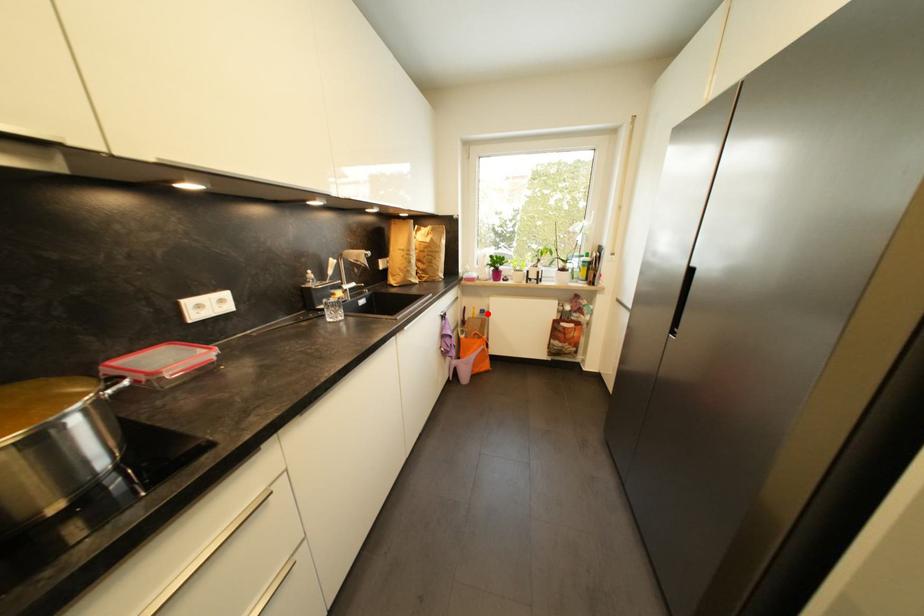
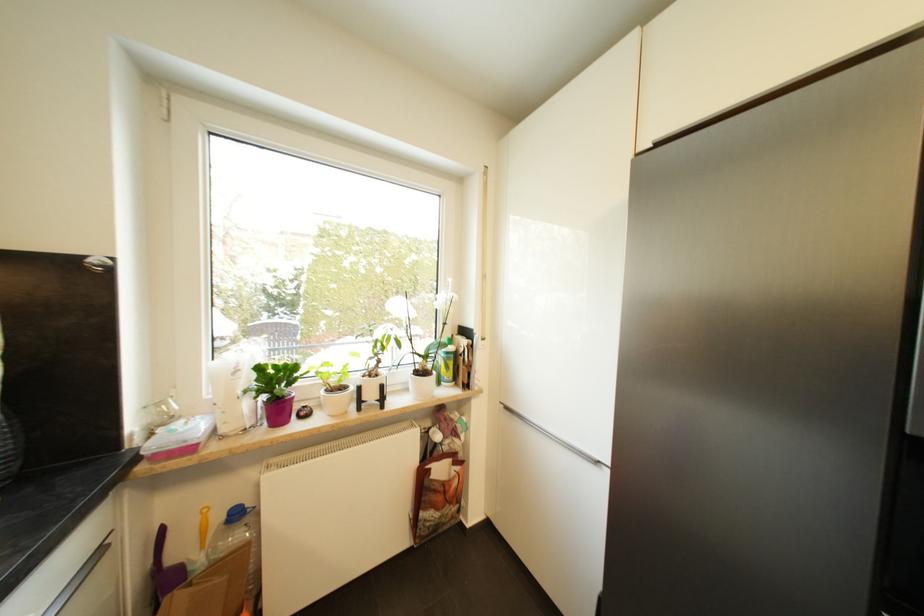
Question: I am providing you with two images of the same scene from different viewpoints. A red point is marked on the first image. Can you still see the location of the red point in image 2?

Choices:
 (A) Yes
 (B) No

Answer: (A)